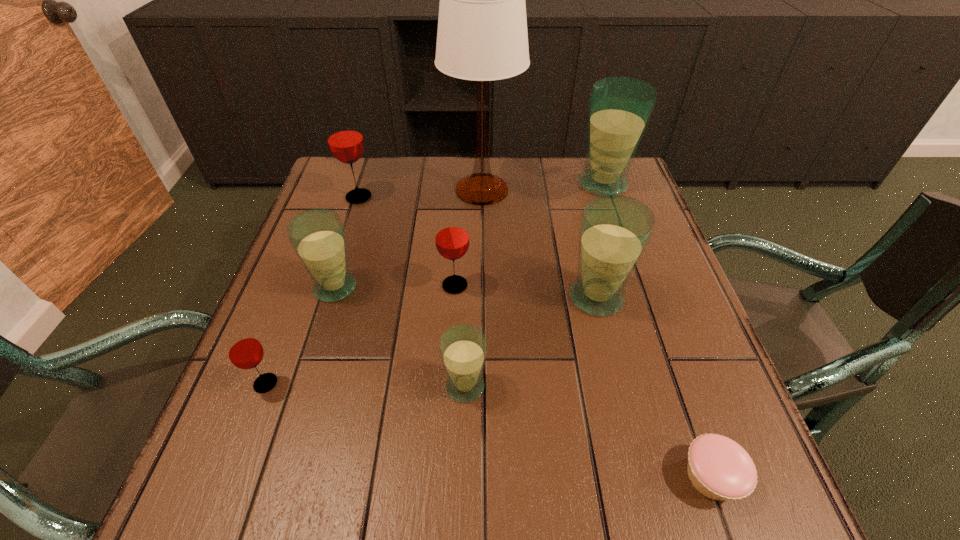
Locate an element on the screen. This screenshot has width=960, height=540. blue glass that stands as the closest to the farthest blue glass is located at coordinates (614, 231).

Identify which blue glass is the second closest to the smallest blue glass. Please provide its 2D coordinates. Your answer should be formatted as a tuple, i.e. [(x, y)], where the tuple contains the x and y coordinates of a point satisfying the conditions above.

[(317, 235)]

You are a GUI agent. You are given a task and a screenshot of the screen. Output one action in this format:
    pyautogui.click(x=<x>, y=<y>)
    Task: Click on the red glass object that ranks as the closest to the second farthest red glass
    The width and height of the screenshot is (960, 540).
    Given the screenshot: What is the action you would take?
    pyautogui.click(x=345, y=140)

Where is `the second closest red glass to the smallest red glass`? the second closest red glass to the smallest red glass is located at coordinates (345, 140).

I want to click on vacant space that satisfies the following two spatial constraints: 1. on the front side of the farthest red glass; 2. on the left side of the second biggest blue glass, so click(326, 298).

At what (x,y) coordinates should I click in order to perform the action: click on vacant space that satisfies the following two spatial constraints: 1. on the back side of the nearest red glass; 2. on the left side of the second biggest blue glass. Please return your answer as a coordinate pair (x, y). The image size is (960, 540). Looking at the image, I should click on (299, 298).

Where is `vacant space that satisfies the following two spatial constraints: 1. on the front side of the second nearest red glass; 2. on the right side of the farthest red glass`? This screenshot has height=540, width=960. vacant space that satisfies the following two spatial constraints: 1. on the front side of the second nearest red glass; 2. on the right side of the farthest red glass is located at coordinates (330, 285).

This screenshot has width=960, height=540. Find the location of `vacant position in the image that satisfies the following two spatial constraints: 1. on the front side of the second blue glass from left to right; 2. on the right side of the smallest red glass`. vacant position in the image that satisfies the following two spatial constraints: 1. on the front side of the second blue glass from left to right; 2. on the right side of the smallest red glass is located at coordinates (265, 387).